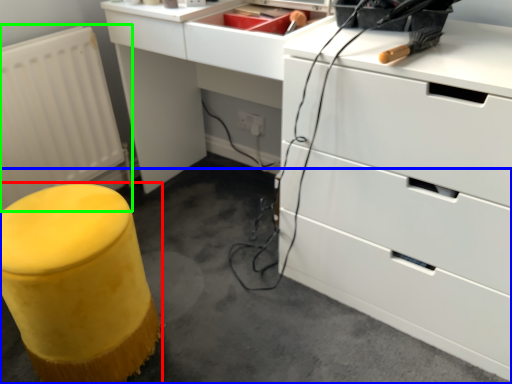
Question: Estimate the real-world distances between objects in this image. Which object is closer to furniture (highlighted by a red box), concrete (highlighted by a blue box) or radiator (highlighted by a green box)?

Choices:
 (A) concrete
 (B) radiator

Answer: (A)